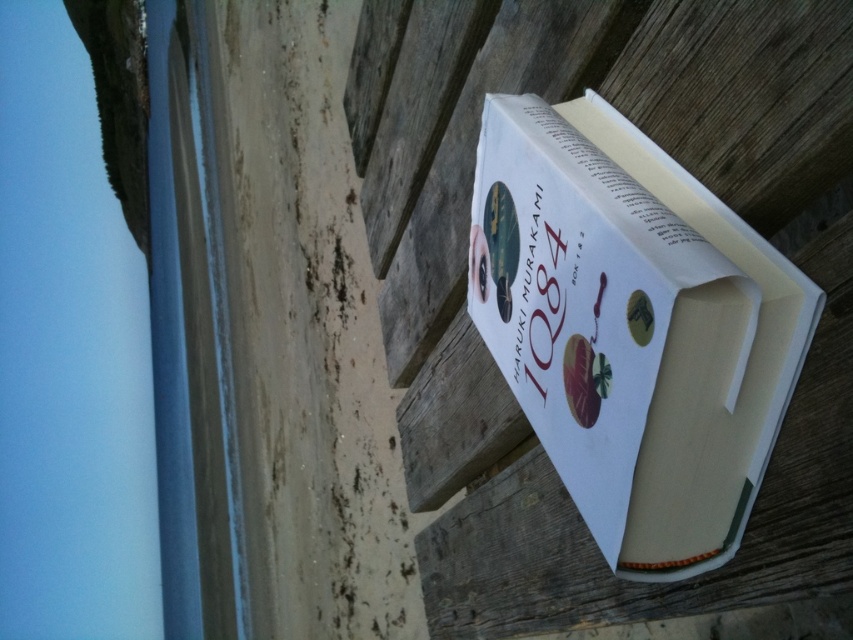
Question: Does white paper book at center have a lesser width compared to white paper at upper center?

Choices:
 (A) yes
 (B) no

Answer: (B)

Question: Where is white paper book at upper center located in relation to white paper at upper center in the image?

Choices:
 (A) below
 (B) above

Answer: (A)

Question: Which point appears farthest from the camera in this image?

Choices:
 (A) (592, 189)
 (B) (564, 362)

Answer: (B)

Question: Can you confirm if white paper book at upper center is wider than white paper at upper center?

Choices:
 (A) yes
 (B) no

Answer: (A)

Question: Based on their relative distances, which object is farther from the white paper at upper center?

Choices:
 (A) white paper book at upper center
 (B) white paper book at center

Answer: (A)

Question: Which object is the farthest from the white paper book at upper center?

Choices:
 (A) white paper at upper center
 (B) white paper book at center

Answer: (A)